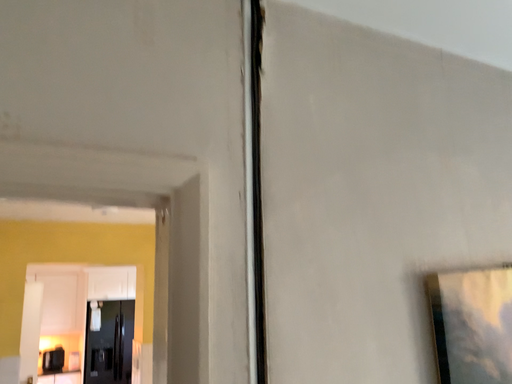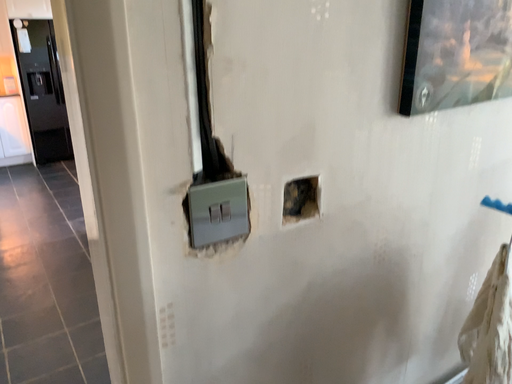
Question: Which way did the camera rotate in the video?

Choices:
 (A) rotated right
 (B) rotated left

Answer: (A)